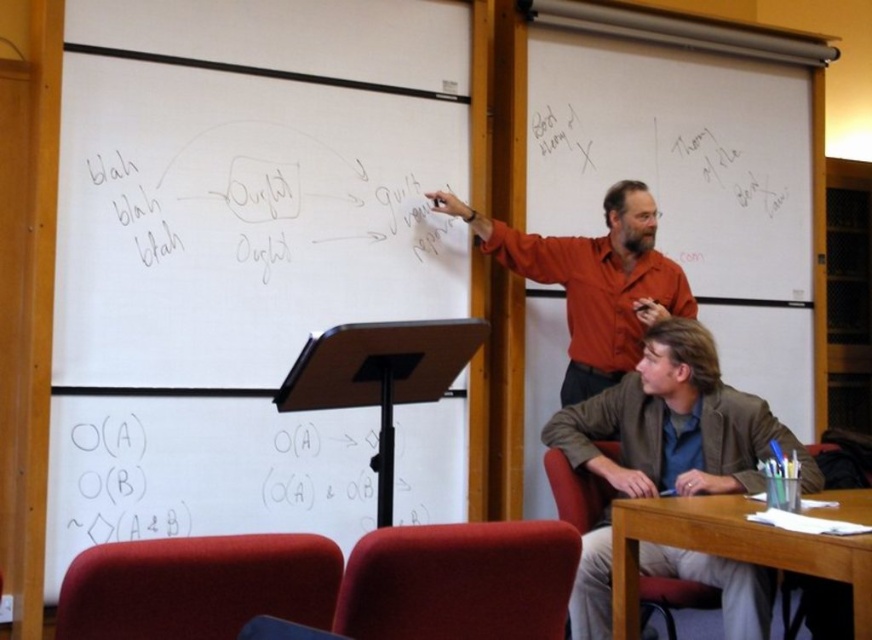
Does point (581, 634) lie in front of point (664, 314)?

That is True.

Between brown leather jacket at lower right and matte orange shirt at center, which one appears on the left side from the viewer's perspective?

matte orange shirt at center is more to the left.

Does point (693, 572) come farther from viewer compared to point (621, 374)?

No, (693, 572) is closer to viewer.

The image size is (872, 640). In order to click on brown leather jacket at lower right in this screenshot , I will do `click(676, 422)`.

Who is taller, brown leather jacket at lower right or wooden table at lower right?

With more height is brown leather jacket at lower right.

Which is above, brown leather jacket at lower right or wooden table at lower right?

brown leather jacket at lower right is above.

Locate an element on the screen. The image size is (872, 640). brown leather jacket at lower right is located at coordinates (676, 422).

At what (x,y) coordinates should I click in order to perform the action: click on brown leather jacket at lower right. Please return your answer as a coordinate pair (x, y). Image resolution: width=872 pixels, height=640 pixels. Looking at the image, I should click on (676, 422).

Locate an element on the screen. The image size is (872, 640). matte orange shirt at center is located at coordinates coord(593,282).

Is matte orange shirt at center positioned at the back of wooden table at lower right?

Yes.

What do you see at coordinates (593, 282) in the screenshot? The image size is (872, 640). I see `matte orange shirt at center` at bounding box center [593, 282].

The height and width of the screenshot is (640, 872). I want to click on matte orange shirt at center, so click(593, 282).